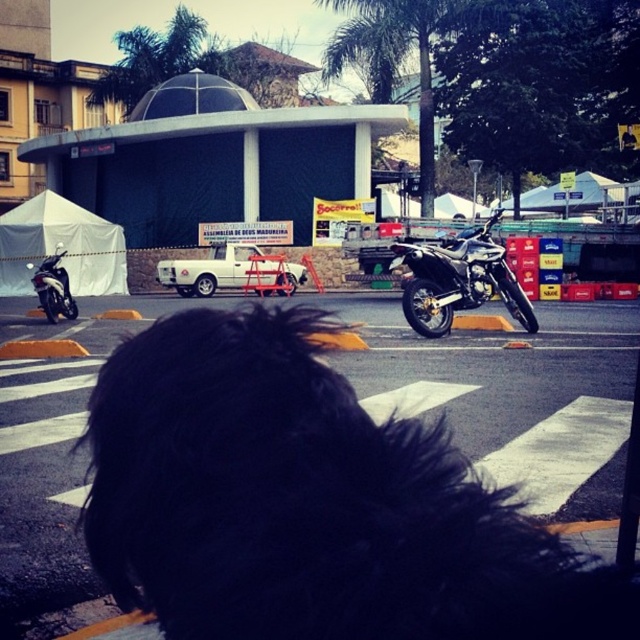
Question: Does white matte pickup truck at center have a greater width compared to shiny black motorcycle at left?

Choices:
 (A) yes
 (B) no

Answer: (B)

Question: Can you confirm if black fluffy hair at center is thinner than shiny black motorcycle at left?

Choices:
 (A) no
 (B) yes

Answer: (B)

Question: Which object is farther from the camera taking this photo?

Choices:
 (A) shiny black motorcycle at left
 (B) white matte pickup truck at center
 (C) shiny black motorcycle at center

Answer: (B)

Question: Which is nearer to the shiny black motorcycle at center?

Choices:
 (A) white matte pickup truck at center
 (B) shiny black motorcycle at left

Answer: (A)

Question: From the image, what is the correct spatial relationship of white matte pickup truck at center in relation to shiny black motorcycle at left?

Choices:
 (A) left
 (B) right

Answer: (B)

Question: Estimate the real-world distances between objects in this image. Which object is farther from the white matte pickup truck at center?

Choices:
 (A) shiny black motorcycle at center
 (B) shiny black motorcycle at left
 (C) black fluffy hair at center

Answer: (C)